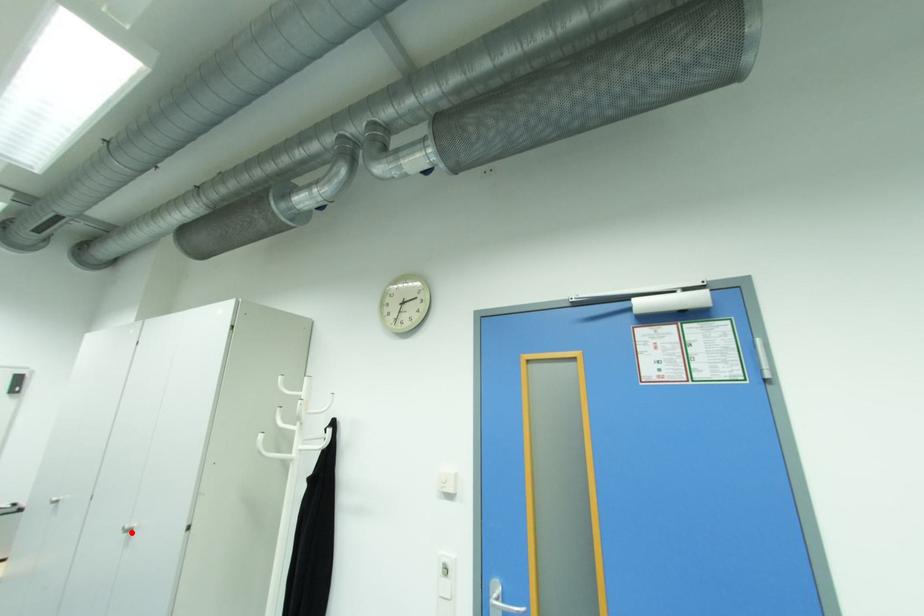
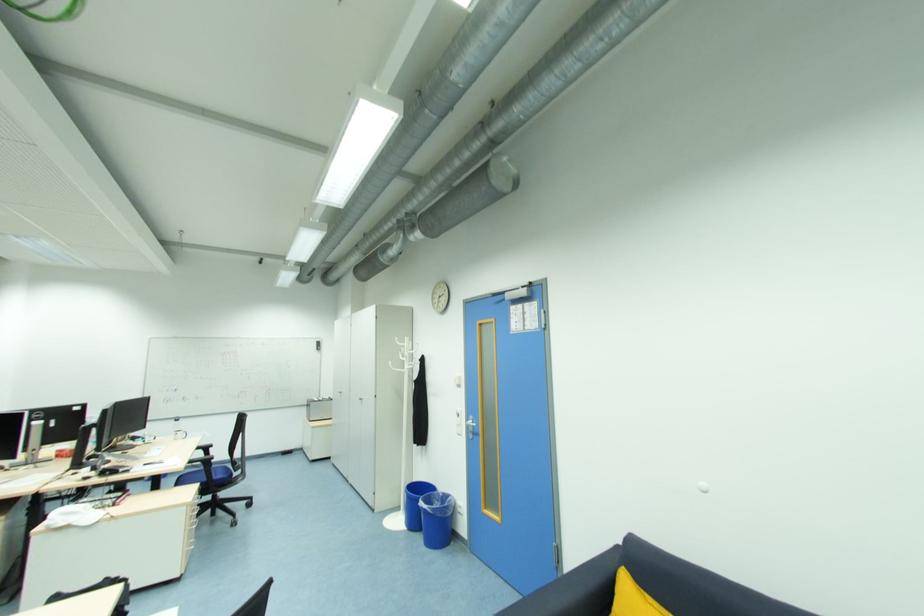
Question: I am providing you with two images of the same scene from different viewpoints. Given a red point in image1, look at the same physical point in image2. Is it:

Choices:
 (A) Closer to the viewpoint
 (B) Farther from the viewpoint

Answer: (B)